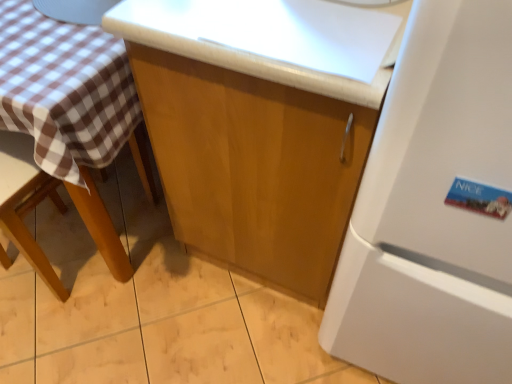
Where is `free space to the left of glossy wood cabinet at center`? The image size is (512, 384). free space to the left of glossy wood cabinet at center is located at coordinates point(133,270).